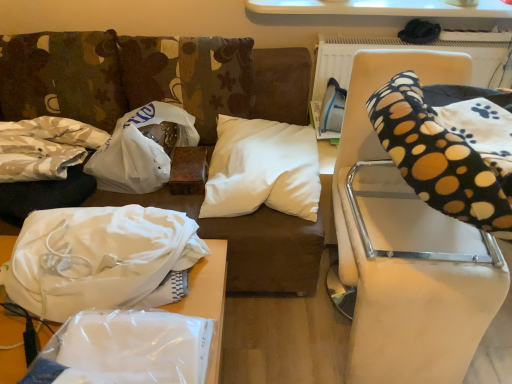
Question: Is black polka dot bean bag chair at right spatially inside black polka dot fabric at right, which appears as the 2th furniture when viewed from the left, or outside of it?

Choices:
 (A) inside
 (B) outside

Answer: (A)

Question: From a real-world perspective, is black polka dot bean bag chair at right above or below black polka dot fabric at right, arranged as the first furniture when viewed from the right?

Choices:
 (A) above
 (B) below

Answer: (A)

Question: Which object is the farthest from the white fabric at lower left, which appears as the 2th material when viewed from the left?

Choices:
 (A) white soft pillow at center
 (B) white plastic bag at center, the 1th material viewed from the right
 (C) black polka dot bean bag chair at right
 (D) white fabric at left, the 1th material in the left-to-right sequence
 (E) transparent plastic bag at lower left, arranged as the first furniture when viewed from the left

Answer: (C)

Question: Which of these objects is positioned farthest from the white fabric at lower left, which appears as the 2th material when viewed from the left?

Choices:
 (A) white fabric at left, the 1th material in the left-to-right sequence
 (B) white soft pillow at center
 (C) black polka dot bean bag chair at right
 (D) black polka dot fabric at right, which appears as the 2th furniture when viewed from the left
 (E) transparent plastic bag at lower left, acting as the second furniture starting from the right

Answer: (C)